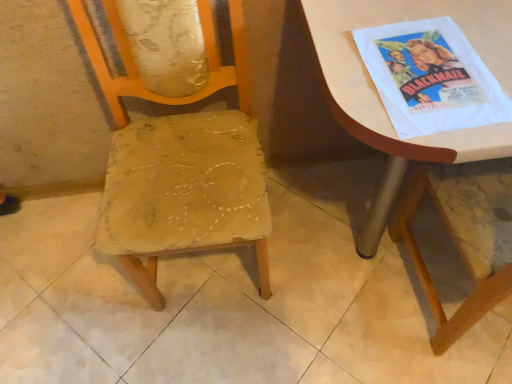
Locate an element on the screen. vacant space to the right of worn fabric chair at center is located at coordinates (304, 256).